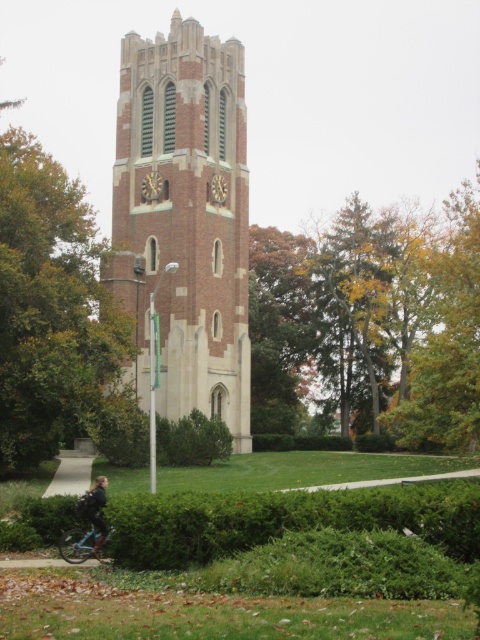
Is brick tower at center wider than yellow-green leaves at upper right?

In fact, brick tower at center might be narrower than yellow-green leaves at upper right.

Which is more to the right, brick tower at center or yellow-green leaves at upper right?

yellow-green leaves at upper right

Is point (139, 204) in front of point (465, 378)?

No, (139, 204) is further to viewer.

Image resolution: width=480 pixels, height=640 pixels. In order to click on brick tower at center in this screenshot , I will do `click(184, 218)`.

Which of these two, green leafy tree at center or yellow-green leaves at upper right, stands taller?

yellow-green leaves at upper right is taller.

Does point (372, 234) come behind point (443, 396)?

Yes, point (372, 234) is farther from viewer.

Which is behind, point (285, 234) or point (470, 442)?

Positioned behind is point (285, 234).

This screenshot has height=640, width=480. In order to click on green leafy tree at center in this screenshot , I will do `click(372, 324)`.

Which is below, brick tower at center or teal matte bicycle at lower left?

teal matte bicycle at lower left is lower down.

Who is positioned more to the right, brick tower at center or teal matte bicycle at lower left?

brick tower at center

Does point (184, 20) come in front of point (76, 532)?

No, it is behind (76, 532).

Locate an element on the screen. brick tower at center is located at coordinates (184, 218).